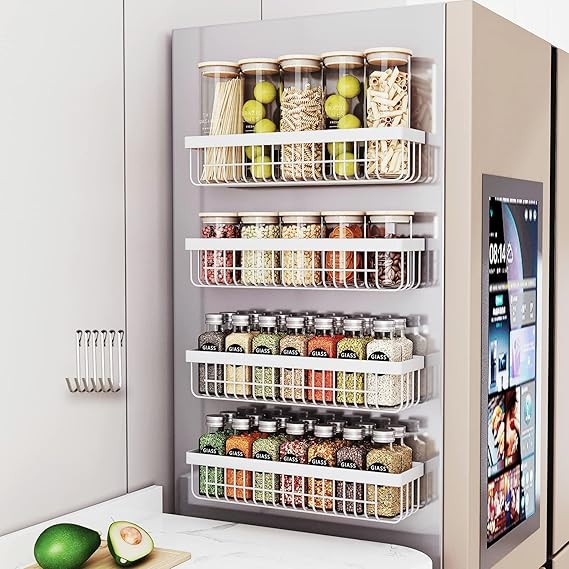
I want to click on tall jars on top shelf, so click(221, 93), click(259, 98), click(308, 94), click(353, 98), click(399, 103).